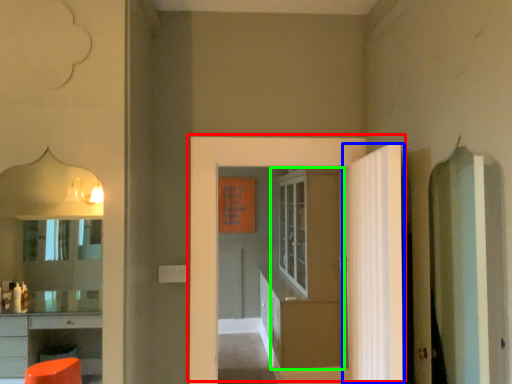
Question: Based on their relative distances, which object is farther from door (highlighted by a red box)? Choose from door (highlighted by a blue box) and door (highlighted by a green box).

Choices:
 (A) door
 (B) door

Answer: (B)